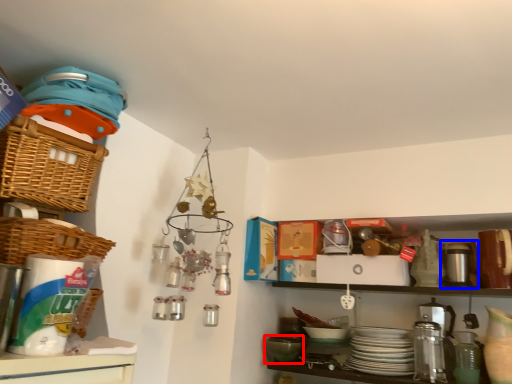
Question: Which object appears closest to the camera in this image, mixing bowl (highlighted by a red box) or appliance (highlighted by a blue box)?

Choices:
 (A) mixing bowl
 (B) appliance

Answer: (B)